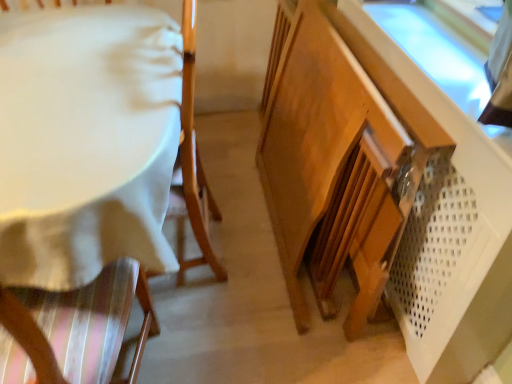
Question: Can you confirm if white fabric-covered table at left is shorter than wooden cabinet at lower right?

Choices:
 (A) no
 (B) yes

Answer: (A)

Question: Is the position of white fabric-covered table at left more distant than that of wooden cabinet at lower right?

Choices:
 (A) yes
 (B) no

Answer: (A)

Question: Is white fabric-covered table at left located outside wooden cabinet at lower right?

Choices:
 (A) yes
 (B) no

Answer: (A)

Question: Can you confirm if white fabric-covered table at left is positioned to the left of wooden cabinet at lower right?

Choices:
 (A) no
 (B) yes

Answer: (B)

Question: From a real-world perspective, is white fabric-covered table at left on top of wooden cabinet at lower right?

Choices:
 (A) no
 (B) yes

Answer: (B)

Question: From the image's perspective, does white fabric-covered table at left appear lower than wooden cabinet at lower right?

Choices:
 (A) yes
 (B) no

Answer: (B)

Question: Can you confirm if wooden cabinet at lower right is thinner than white fabric-covered table at left?

Choices:
 (A) yes
 (B) no

Answer: (A)

Question: Is wooden cabinet at lower right touching white fabric-covered table at left?

Choices:
 (A) no
 (B) yes

Answer: (A)

Question: From a real-world perspective, is wooden cabinet at lower right over white fabric-covered table at left?

Choices:
 (A) no
 (B) yes

Answer: (A)

Question: Is wooden cabinet at lower right wider than white fabric-covered table at left?

Choices:
 (A) yes
 (B) no

Answer: (B)

Question: From a real-world perspective, is wooden cabinet at lower right beneath white fabric-covered table at left?

Choices:
 (A) yes
 (B) no

Answer: (A)

Question: Is wooden cabinet at lower right facing towards white fabric-covered table at left?

Choices:
 (A) yes
 (B) no

Answer: (A)

Question: From a real-world perspective, is white fabric-covered table at left positioned above or below wooden cabinet at lower right?

Choices:
 (A) above
 (B) below

Answer: (A)